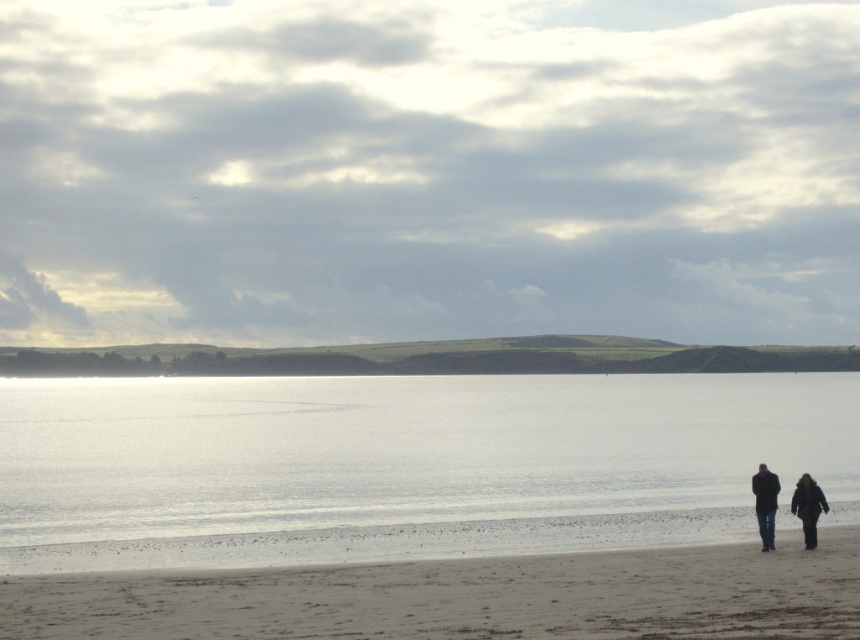
Question: Which of the following is the farthest from the observer?

Choices:
 (A) dark brown leather jacket at lower right
 (B) dark blue jeans at lower right

Answer: (B)

Question: Does dark blue jeans at lower right lie behind black matte coat at lower right?

Choices:
 (A) yes
 (B) no

Answer: (A)

Question: Does clear water at center appear on the right side of light brown sand at lower center?

Choices:
 (A) no
 (B) yes

Answer: (A)

Question: Does light brown sand at lower center appear under black matte coat at lower right?

Choices:
 (A) yes
 (B) no

Answer: (A)

Question: Which of the following is the closest to the observer?

Choices:
 (A) (771, 484)
 (B) (806, 541)
 (C) (771, 536)

Answer: (B)

Question: Which point appears farthest from the camera in this image?

Choices:
 (A) (772, 524)
 (B) (45, 604)
 (C) (822, 506)

Answer: (A)